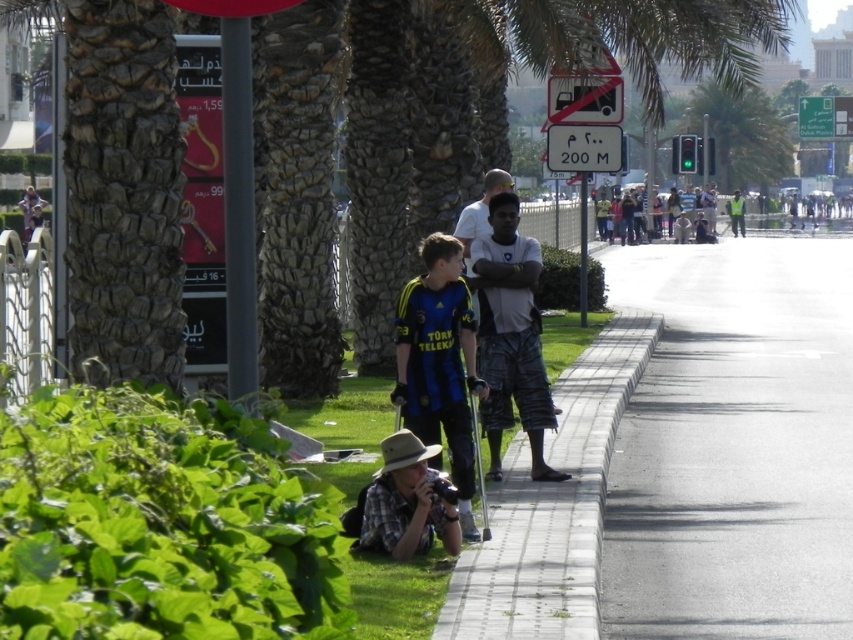
You are a photographer who needs to capture a closeup of both the camouflage pants at center and the light brown shorts at center. Since you want to ensure both are clearly visible, which one should you focus on first to avoid blurring, considering their sizes?

The camouflage pants at center is larger in size than light brown shorts at center, so you should focus on the camouflage pants at center first to ensure clarity since it occupies more of the frame.

You are standing at the point with coordinates 0.0, 0.0. You want to walk to the green leafy palm tree at center. Which direction should you walk in?

The green leafy palm tree at center is located at coordinates [741,134]. Since you are at [0,0], you should walk towards the northeast direction to reach it.